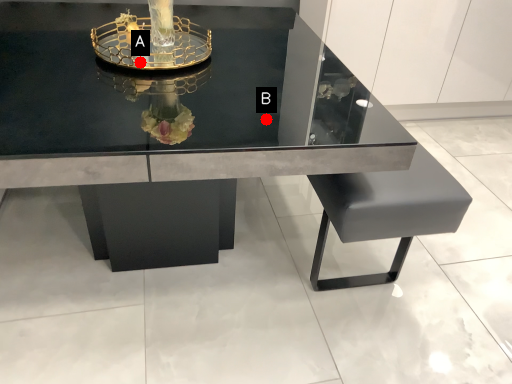
Question: Two points are circled on the image, labeled by A and B beside each circle. Which point is closer to the camera taking this photo?

Choices:
 (A) A is closer
 (B) B is closer

Answer: (B)